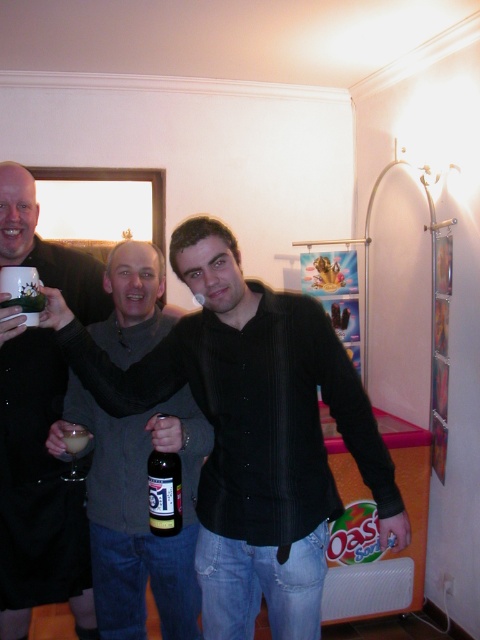
You are a photographer trying to capture the scene with a camera. You notice a point at coordinates [36,490] in the image. Based on the scene description, can you determine what object this point is located on?

The point at coordinates [36,490] is located on the matte black mug at upper left.

You are at a party and want to choose a drink that fits in your coat pocket. The coat pocket is 10 cm wide. You see the matte black mug at upper left and the translucent glass beer at center. Which drink can fit in your pocket?

The translucent glass beer at center is narrower than the matte black mug at upper left. Since the coat pocket is 10 cm wide, the translucent glass beer at center might fit, but the matte black mug at upper left might be too wide.